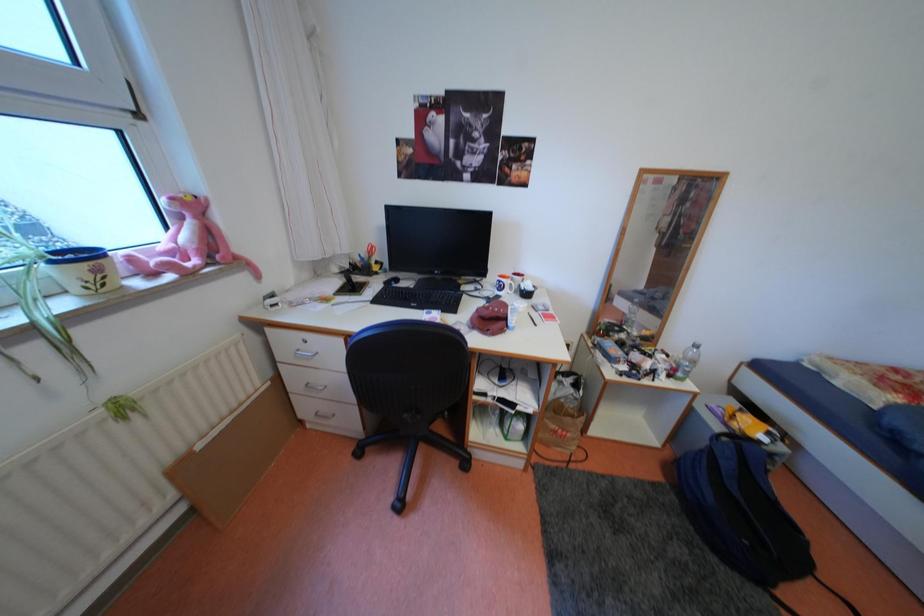
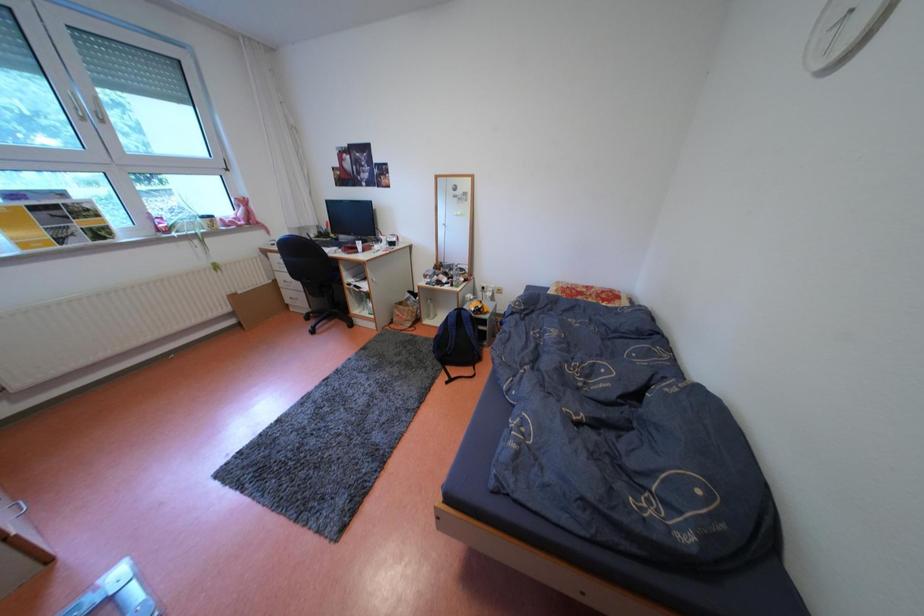
Looking at this image, the images are taken continuously from a first-person perspective. In which direction are you moving?

The cameraman walked toward right, backward.